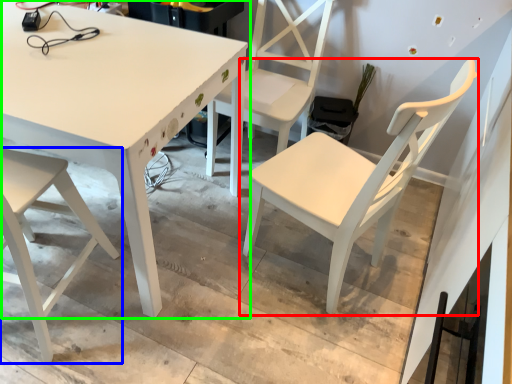
Question: Which object is the closest to the chair (highlighted by a red box)? Choose among these: chair (highlighted by a blue box) or table (highlighted by a green box).

Choices:
 (A) chair
 (B) table

Answer: (B)